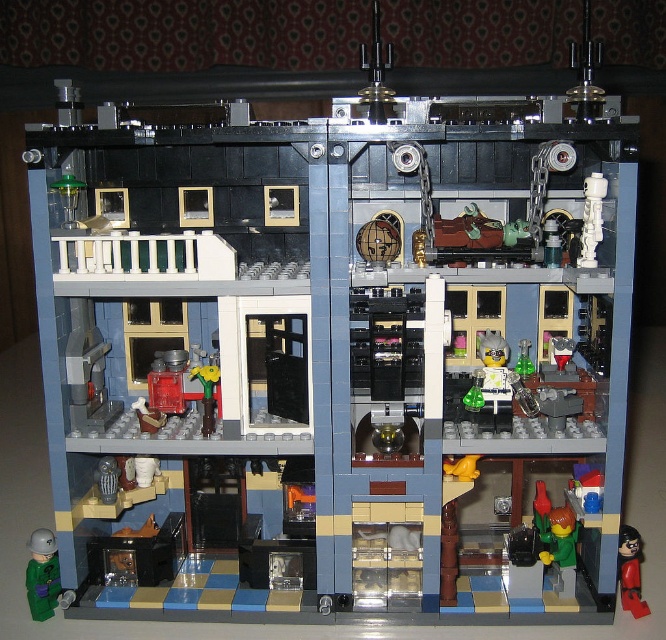
Looking at this image, which of these two, green matte figure at lower left or shiny black figure at lower right, stands taller?

Standing taller between the two is green matte figure at lower left.

Is green matte figure at lower left below shiny black figure at lower right?

Actually, green matte figure at lower left is above shiny black figure at lower right.

Describe the element at coordinates (43, 573) in the screenshot. This screenshot has height=640, width=666. I see `green matte figure at lower left` at that location.

This screenshot has height=640, width=666. I want to click on green matte figure at lower left, so click(x=43, y=573).

Is green matte figure at lower left to the left of translucent yellow plastic at center from the viewer's perspective?

Correct, you'll find green matte figure at lower left to the left of translucent yellow plastic at center.

Who is positioned more to the right, green matte figure at lower left or translucent yellow plastic at center?

translucent yellow plastic at center is more to the right.

Who is more forward, (39, 556) or (486, 403)?

Point (39, 556)

Where is `green matte figure at lower left`? The width and height of the screenshot is (666, 640). green matte figure at lower left is located at coordinates (43, 573).

Does translucent yellow plastic at center have a smaller size compared to shiny black figure at lower right?

No, translucent yellow plastic at center is not smaller than shiny black figure at lower right.

Is translucent yellow plastic at center closer to the viewer compared to shiny black figure at lower right?

No, it is not.

Between point (501, 360) and point (637, 588), which one is positioned behind?

The point (501, 360) is more distant.

You are a GUI agent. You are given a task and a screenshot of the screen. Output one action in this format:
    pyautogui.click(x=<x>, y=<y>)
    Task: Click on the translucent yellow plastic at center
    Image resolution: width=666 pixels, height=640 pixels.
    Given the screenshot: What is the action you would take?
    pyautogui.click(x=492, y=371)